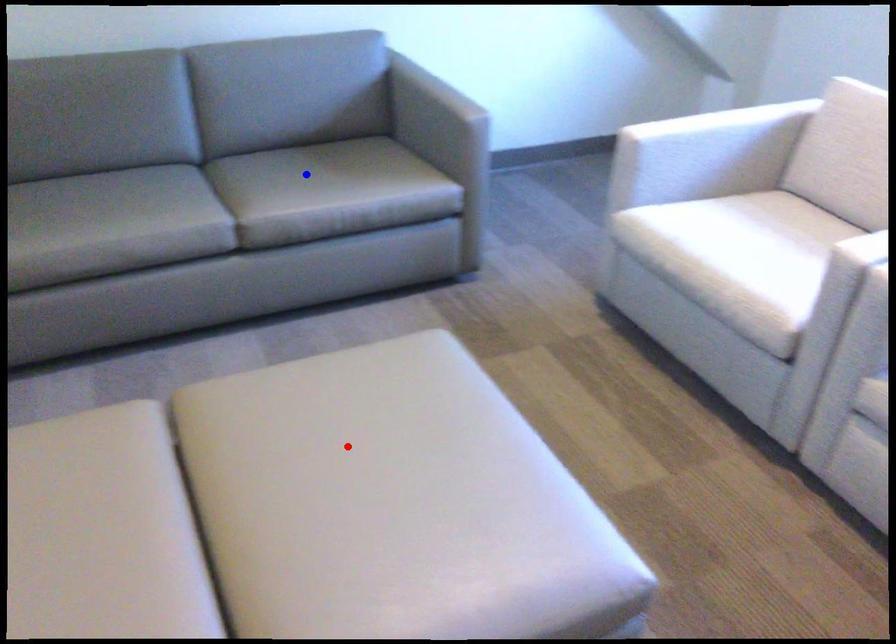
Question: In the image, two points are highlighted. Which point is nearer to the camera? Reply with the corresponding letter.

Choices:
 (A) blue point
 (B) red point

Answer: (B)